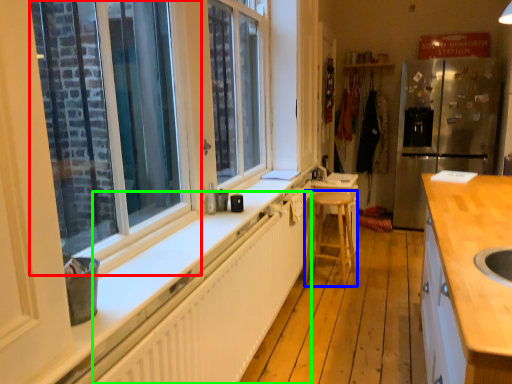
Question: Which object is positioned farthest from window (highlighted by a red box)? Select from bar stool (highlighted by a blue box) and radiator (highlighted by a green box).

Choices:
 (A) bar stool
 (B) radiator

Answer: (A)